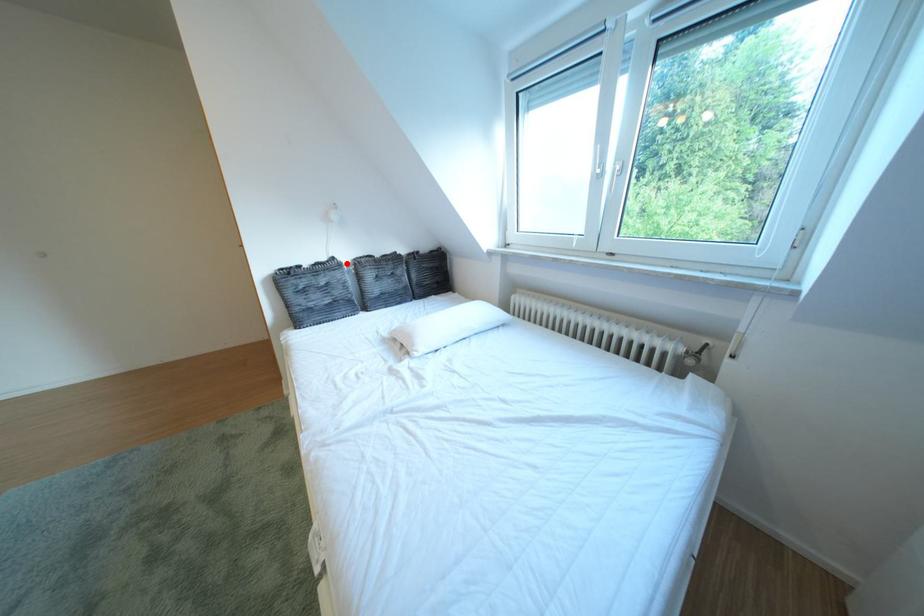
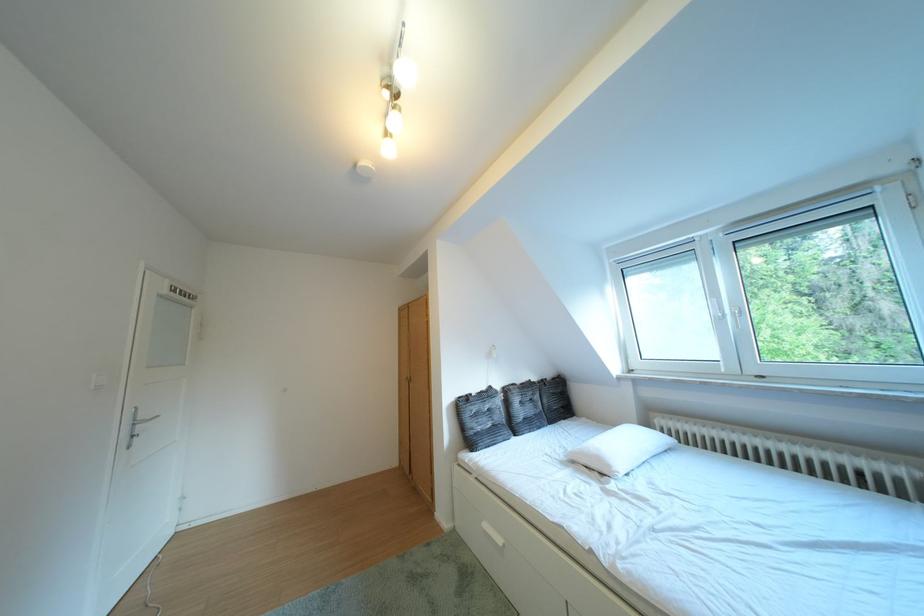
The point at the highlighted location is marked in the first image. Where is the corresponding point in the second image?

(504, 392)